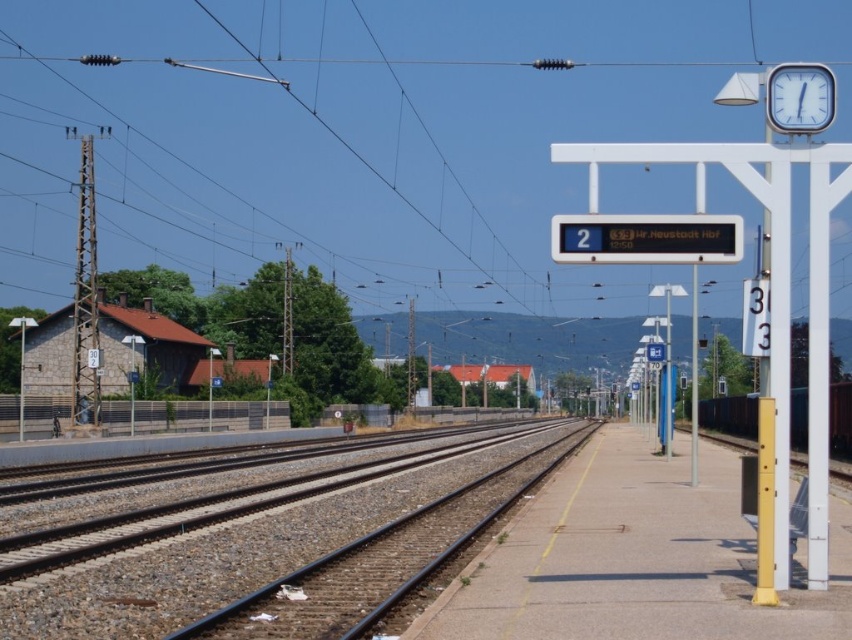
Question: Which object is the farthest from the metallic red train at right?

Choices:
 (A) black metal train track at center
 (B) white plastic clock at upper right
 (C) concrete platform at center

Answer: (B)

Question: Where is concrete platform at center located in relation to metallic red train at right in the image?

Choices:
 (A) below
 (B) above

Answer: (B)

Question: Estimate the real-world distances between objects in this image. Which object is farther from the black metal train track at center?

Choices:
 (A) concrete platform at center
 (B) metallic red train at right
 (C) white plastic clock at upper right

Answer: (C)

Question: Does black metal train track at center appear on the right side of white plastic clock at upper right?

Choices:
 (A) yes
 (B) no

Answer: (B)

Question: Can you confirm if concrete platform at center is positioned to the left of metallic red train at right?

Choices:
 (A) yes
 (B) no

Answer: (A)

Question: Which object is farther from the camera taking this photo?

Choices:
 (A) concrete platform at center
 (B) black metal train track at center
 (C) white plastic clock at upper right

Answer: (B)